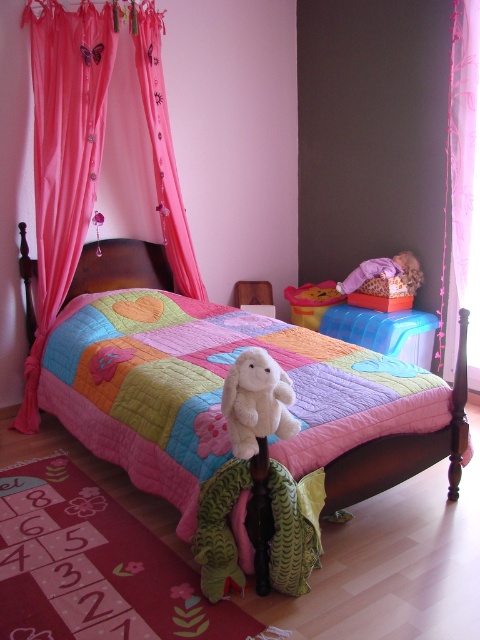
Question: In this image, where is patchwork quilt at center located relative to pink sheer curtains at upper left?

Choices:
 (A) below
 (B) above

Answer: (A)

Question: Estimate the real-world distances between objects in this image. Which object is closer to the matte yellow plastic toy at center?

Choices:
 (A) pink sheer curtain at right
 (B) pink sheer curtains at upper left
 (C) pink fabric curtain at upper left
 (D) patchwork quilt at center

Answer: (B)

Question: Which point is closer to the camera?

Choices:
 (A) pink sheer curtain at right
 (B) matte yellow plastic toy at center

Answer: (A)

Question: Observing the image, what is the correct spatial positioning of pink sheer curtain at right in reference to pink sheer curtains at upper left?

Choices:
 (A) below
 (B) above

Answer: (A)

Question: Is pink fabric curtain at upper left to the left of matte yellow plastic toy at center from the viewer's perspective?

Choices:
 (A) no
 (B) yes

Answer: (B)

Question: Estimate the real-world distances between objects in this image. Which object is closer to the pink sheer curtain at right?

Choices:
 (A) patchwork quilt at center
 (B) matte yellow plastic toy at center
 (C) pink fabric curtain at upper left

Answer: (B)